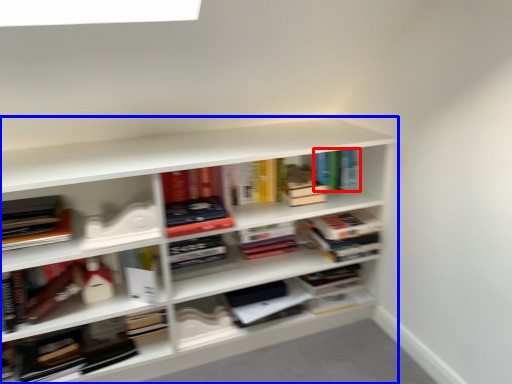
Question: Which point is further to the camera, book (highlighted by a red box) or shelf (highlighted by a blue box)?

Choices:
 (A) book
 (B) shelf

Answer: (A)